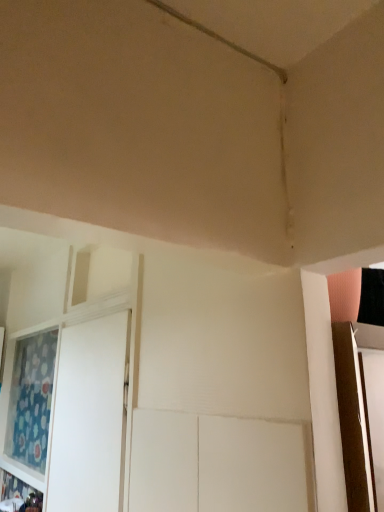
Question: From the image's perspective, is white glossy screen door at left positioned above or below blue floral fabric curtain at left?

Choices:
 (A) above
 (B) below

Answer: (A)

Question: Considering their positions, is white glossy screen door at left located in front of or behind blue floral fabric curtain at left?

Choices:
 (A) front
 (B) behind

Answer: (A)

Question: Is white glossy screen door at left to the left or to the right of blue floral fabric curtain at left in the image?

Choices:
 (A) right
 (B) left

Answer: (A)

Question: Based on their sizes in the image, would you say blue floral fabric curtain at left is bigger or smaller than white glossy screen door at left?

Choices:
 (A) big
 (B) small

Answer: (A)

Question: From the image's perspective, is blue floral fabric curtain at left positioned above or below white glossy screen door at left?

Choices:
 (A) above
 (B) below

Answer: (B)

Question: Relative to white glossy screen door at left, is blue floral fabric curtain at left in front or behind?

Choices:
 (A) front
 (B) behind

Answer: (B)

Question: Is blue floral fabric curtain at left inside or outside of white glossy screen door at left?

Choices:
 (A) outside
 (B) inside

Answer: (A)